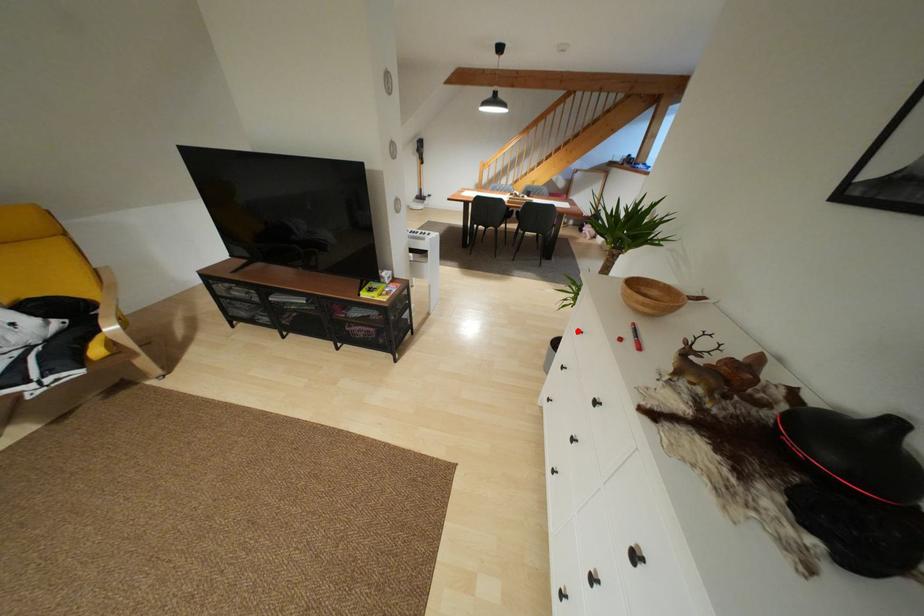
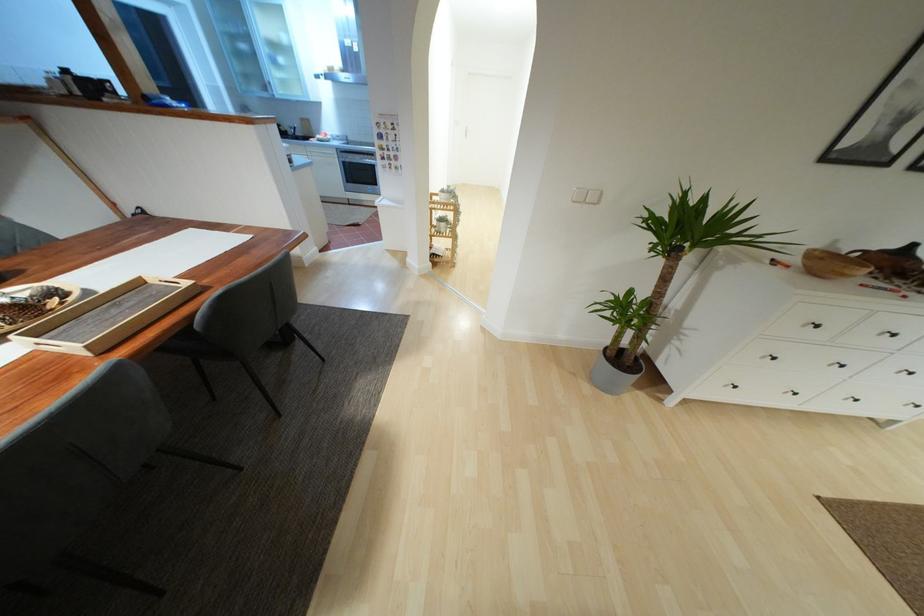
Where in the second image is the point corresponding to the highlighted location from the first image?

(817, 326)